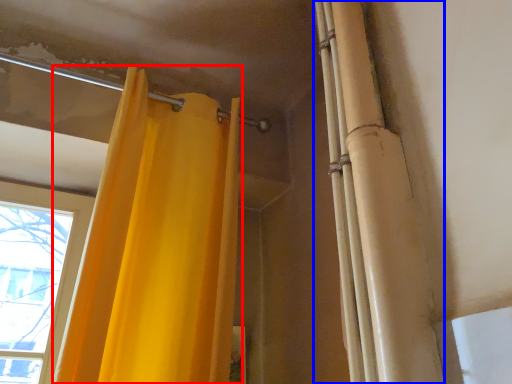
Question: Which object appears farthest to the camera in this image, curtain (highlighted by a red box) or shower curtain (highlighted by a blue box)?

Choices:
 (A) curtain
 (B) shower curtain

Answer: (A)